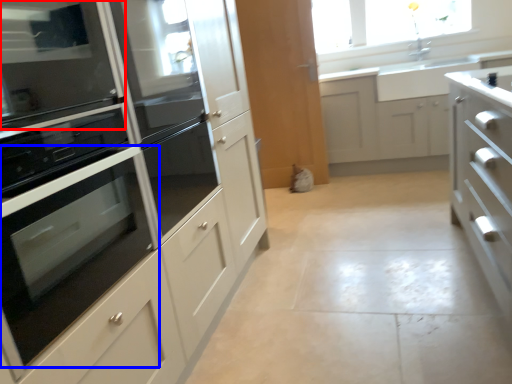
Question: Which point is closer to the camera, home appliance (highlighted by a red box) or oven (highlighted by a blue box)?

Choices:
 (A) home appliance
 (B) oven

Answer: (B)